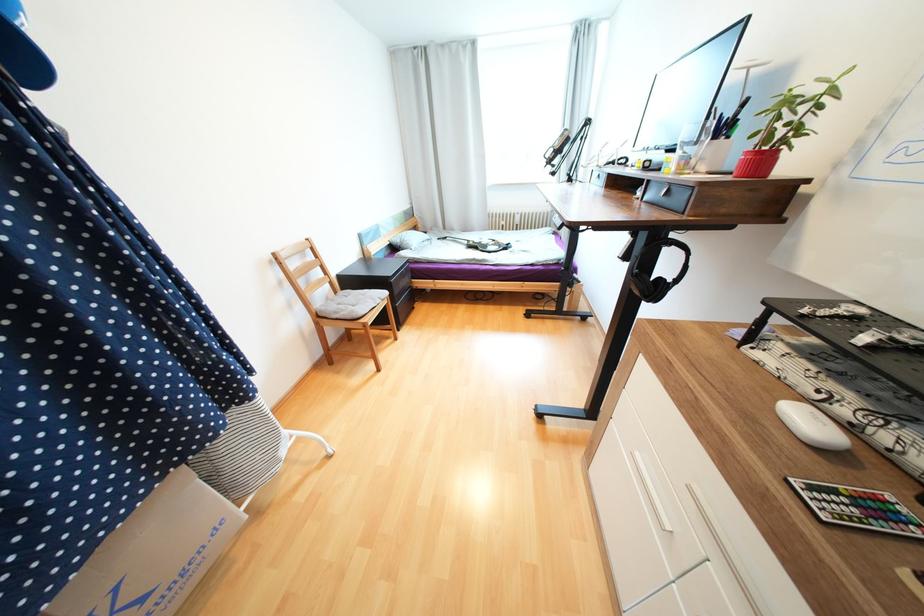
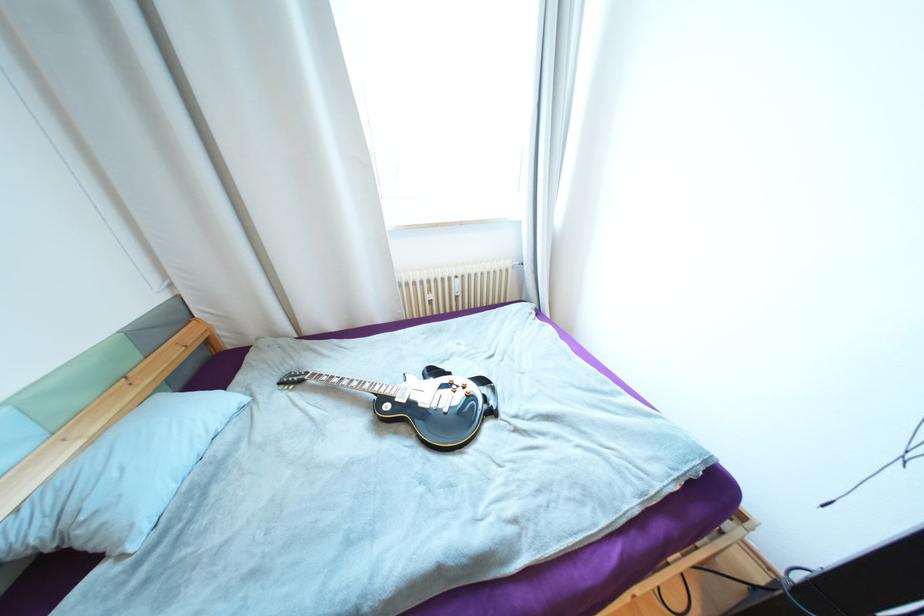
Question: In a continuous first-person perspective shot, in which direction is the camera moving?

Choices:
 (A) Left
 (B) Right
 (C) Forward
 (D) Backward

Answer: (C)